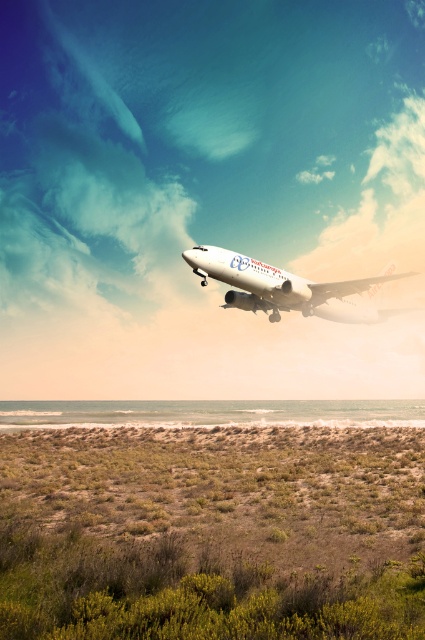
Can you confirm if green shrubbery at lower center is positioned above white glossy airplane at upper center?

No.

Who is higher up, green shrubbery at lower center or white glossy airplane at upper center?

white glossy airplane at upper center is higher up.

Locate an element on the screen. green shrubbery at lower center is located at coordinates (212, 532).